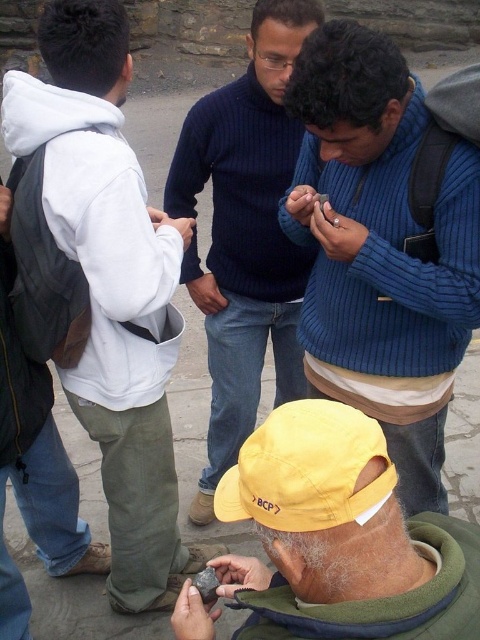
Question: Does white fleece jacket at left appear on the right side of yellow fabric baseball cap at lower center?

Choices:
 (A) yes
 (B) no

Answer: (B)

Question: Which point appears farthest from the camera in this image?

Choices:
 (A) (384, 362)
 (B) (248, 481)

Answer: (A)

Question: Estimate the real-world distances between objects in this image. Which object is closer to the yellow fabric cap at center?

Choices:
 (A) dark blue sweater at center
 (B) blue ribbed sweater at center
 (C) yellow fabric baseball cap at lower center

Answer: (C)

Question: Which object is positioned closest to the blue ribbed sweater at center?

Choices:
 (A) white fleece jacket at left
 (B) yellow fabric baseball cap at lower center

Answer: (B)

Question: Can you confirm if blue ribbed sweater at center is positioned to the right of white fleece jacket at left?

Choices:
 (A) no
 (B) yes

Answer: (B)

Question: Can you confirm if white fleece jacket at left is bigger than matte black phone at lower center?

Choices:
 (A) yes
 (B) no

Answer: (A)